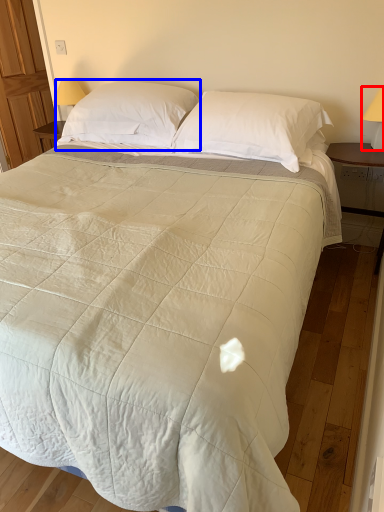
Question: Among these objects, which one is farthest to the camera, table lamp (highlighted by a red box) or pillow (highlighted by a blue box)?

Choices:
 (A) table lamp
 (B) pillow

Answer: (B)